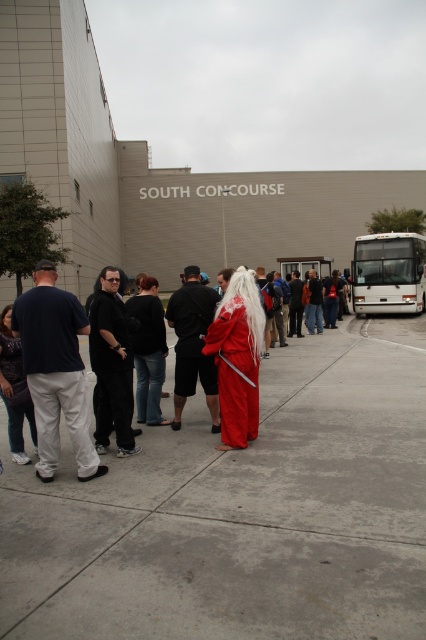
Question: Can you confirm if velvet red robe at center is bigger than white matte bus at right?

Choices:
 (A) yes
 (B) no

Answer: (B)

Question: Which point is closer to the camera taking this photo?

Choices:
 (A) (77, 484)
 (B) (193, 280)
 (C) (101, 429)

Answer: (A)

Question: Based on their relative distances, which object is nearer to the black matte robe at center?

Choices:
 (A) white matte bus at right
 (B) black matte pants at center
 (C) dark blue t-shirt at center
 (D) red satin dress at center

Answer: (C)

Question: Is red satin dress at center thinner than dark blue jeans at center?

Choices:
 (A) no
 (B) yes

Answer: (A)

Question: Which point appears closest to the camera in this image?

Choices:
 (A) (150, 291)
 (B) (163, 461)

Answer: (B)

Question: Where is concrete at center located in relation to matte black robe at center in the image?

Choices:
 (A) below
 (B) above

Answer: (A)